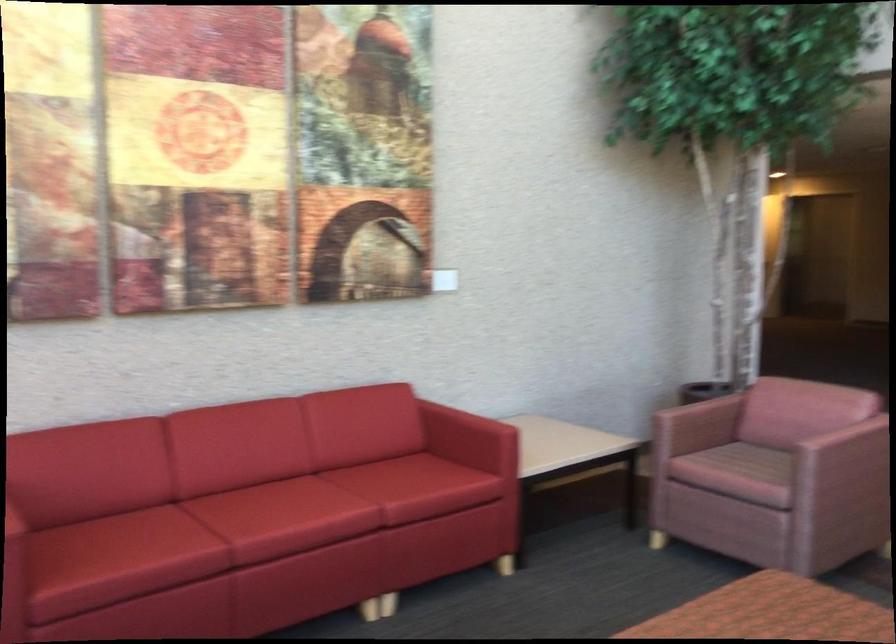
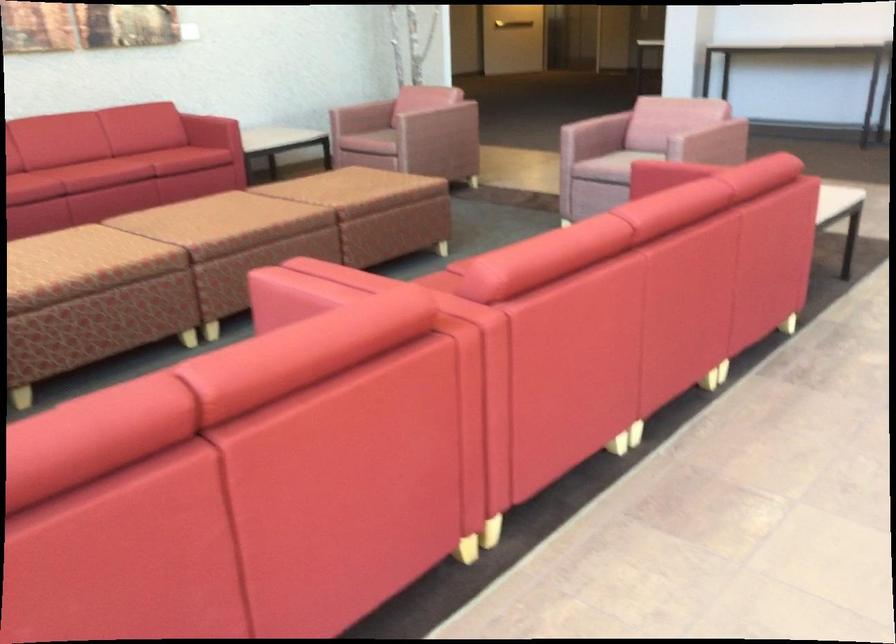
Question: What movement of the cameraman would produce the second image?

Choices:
 (A) Left
 (B) Right
 (C) Forward
 (D) Backward

Answer: (D)